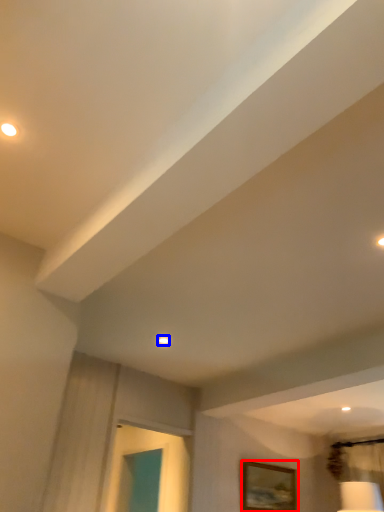
Question: Which object is closer to the camera taking this photo, picture frame (highlighted by a red box) or droplight (highlighted by a blue box)?

Choices:
 (A) picture frame
 (B) droplight

Answer: (B)